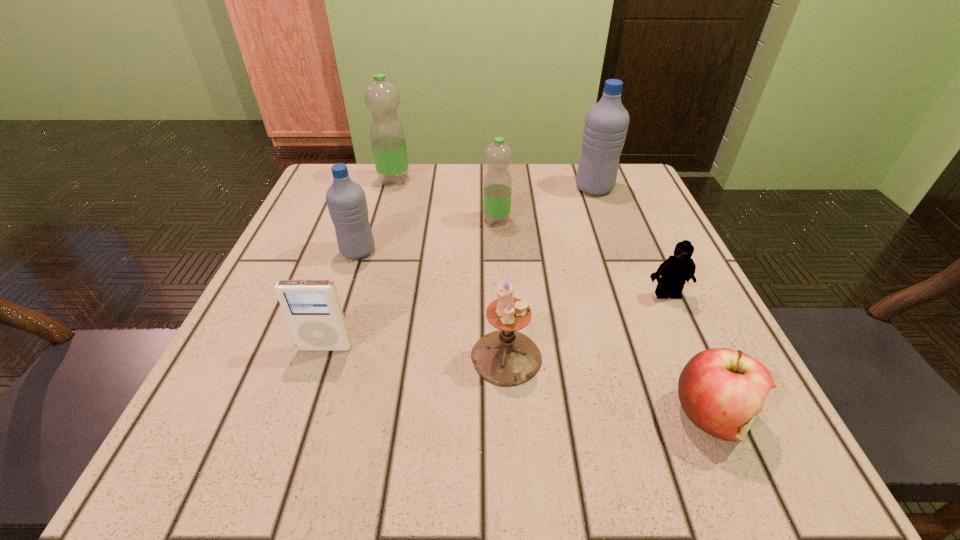
Find the location of `free space at the near edge of the desktop`. free space at the near edge of the desktop is located at coordinates (633, 464).

This screenshot has width=960, height=540. Find the location of `vacant space at the left edge of the desktop`. vacant space at the left edge of the desktop is located at coordinates (260, 361).

Identify the location of free space at the right edge of the desktop. This screenshot has height=540, width=960. (672, 411).

You are a GUI agent. You are given a task and a screenshot of the screen. Output one action in this format:
    pyautogui.click(x=<x>, y=<y>)
    Task: Click on the vacant space at the far left corner of the desktop
    This screenshot has height=540, width=960.
    Given the screenshot: What is the action you would take?
    pyautogui.click(x=372, y=167)

Locate an element on the screen. The height and width of the screenshot is (540, 960). free space between the sixth tallest object and the bigger blue water bottle is located at coordinates (460, 268).

Identify the location of empty space that is in between the third farthest object and the left green water bottle. The image size is (960, 540). (445, 200).

Locate an element on the screen. This screenshot has width=960, height=540. free space between the bigger green water bottle and the third shortest object is located at coordinates (360, 264).

This screenshot has width=960, height=540. What are the coordinates of `vacant space that's between the second water bottle from right to left and the left green water bottle` in the screenshot? It's located at (445, 200).

At what (x,y) coordinates should I click in order to perform the action: click on free point between the purple candle holder and the left green water bottle. Please return your answer as a coordinate pair (x, y). The image size is (960, 540). Looking at the image, I should click on (450, 268).

At what (x,y) coordinates should I click in order to perform the action: click on free spot between the right blue water bottle and the fifth farthest object. Please return your answer as a coordinate pair (x, y). Looking at the image, I should click on (631, 241).